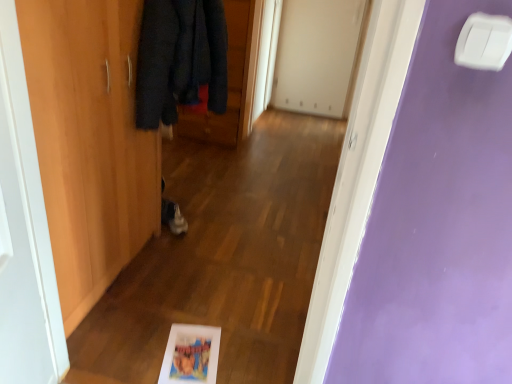
Question: From the image's perspective, would you say white wood door at left, positioned as the third door in back-to-front order, is positioned over dark blue woolen coat at upper left?

Choices:
 (A) no
 (B) yes

Answer: (A)

Question: Does white wood door at left, which appears as the 1th door when viewed from the front, have a greater width compared to dark blue woolen coat at upper left?

Choices:
 (A) yes
 (B) no

Answer: (B)

Question: Can you confirm if white wood door at left, positioned as the third door in back-to-front order, is shorter than dark blue woolen coat at upper left?

Choices:
 (A) yes
 (B) no

Answer: (B)

Question: From a real-world perspective, is white wood door at left, which appears as the 1th door when viewed from the front, positioned under dark blue woolen coat at upper left based on gravity?

Choices:
 (A) yes
 (B) no

Answer: (A)

Question: Considering the relative sizes of white wood door at left, the 2th door from the right, and dark blue woolen coat at upper left in the image provided, is white wood door at left, the 2th door from the right, smaller than dark blue woolen coat at upper left?

Choices:
 (A) yes
 (B) no

Answer: (A)

Question: From a real-world perspective, is dark blue woolen coat at upper left positioned above or below white matte door at upper center, which ranks as the 3th door in left-to-right order?

Choices:
 (A) above
 (B) below

Answer: (A)

Question: Which is correct: dark blue woolen coat at upper left is inside white matte door at upper center, the third door viewed from the front, or outside of it?

Choices:
 (A) inside
 (B) outside

Answer: (B)

Question: Is point (184, 86) closer or farther from the camera than point (304, 56)?

Choices:
 (A) farther
 (B) closer

Answer: (B)

Question: From the image's perspective, is dark blue woolen coat at upper left above or below white matte door at upper center, the first door viewed from the right?

Choices:
 (A) above
 (B) below

Answer: (B)

Question: Considering the positions of white plastic light switch at upper right and white matte door at upper center, which ranks as the 3th door in left-to-right order, in the image, is white plastic light switch at upper right bigger or smaller than white matte door at upper center, which ranks as the 3th door in left-to-right order,?

Choices:
 (A) small
 (B) big

Answer: (A)

Question: From the image's perspective, is white plastic light switch at upper right located above or below white matte door at upper center, the third door viewed from the front?

Choices:
 (A) above
 (B) below

Answer: (B)

Question: Looking at their shapes, would you say white plastic light switch at upper right is wider or thinner than white matte door at upper center, which ranks as the 3th door in left-to-right order?

Choices:
 (A) thin
 (B) wide

Answer: (A)

Question: Is white plastic light switch at upper right taller or shorter than white matte door at upper center, the third door viewed from the front?

Choices:
 (A) tall
 (B) short

Answer: (B)

Question: From a real-world perspective, is matte plastic picture frame at lower center above or below dark blue woolen coat at upper left?

Choices:
 (A) below
 (B) above

Answer: (A)

Question: Considering the positions of matte plastic picture frame at lower center and dark blue woolen coat at upper left in the image, is matte plastic picture frame at lower center bigger or smaller than dark blue woolen coat at upper left?

Choices:
 (A) small
 (B) big

Answer: (A)